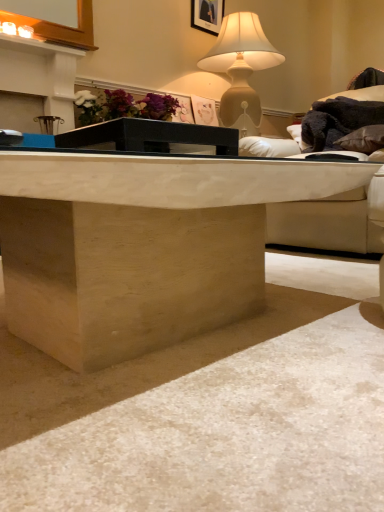
Question: Does black glass table at center have a larger size compared to brown leather pillow at upper right?

Choices:
 (A) no
 (B) yes

Answer: (A)

Question: Can you confirm if black glass table at center is taller than brown leather pillow at upper right?

Choices:
 (A) no
 (B) yes

Answer: (A)

Question: Does black glass table at center have a lesser height compared to brown leather pillow at upper right?

Choices:
 (A) yes
 (B) no

Answer: (A)

Question: From the image's perspective, does black glass table at center appear lower than brown leather pillow at upper right?

Choices:
 (A) no
 (B) yes

Answer: (B)

Question: Considering the relative positions of black glass table at center and brown leather pillow at upper right in the image provided, is black glass table at center in front of brown leather pillow at upper right?

Choices:
 (A) yes
 (B) no

Answer: (A)

Question: Is brown leather pillow at upper right bigger or smaller than white leather couch at upper right?

Choices:
 (A) small
 (B) big

Answer: (A)

Question: From their relative heights in the image, would you say brown leather pillow at upper right is taller or shorter than white leather couch at upper right?

Choices:
 (A) short
 (B) tall

Answer: (A)

Question: From a real-world perspective, relative to white leather couch at upper right, is brown leather pillow at upper right vertically above or below?

Choices:
 (A) below
 (B) above

Answer: (B)

Question: Considering the positions of brown leather pillow at upper right and white leather couch at upper right in the image, is brown leather pillow at upper right wider or thinner than white leather couch at upper right?

Choices:
 (A) wide
 (B) thin

Answer: (B)

Question: Considering the positions of point (263, 48) and point (210, 142), is point (263, 48) closer or farther from the camera than point (210, 142)?

Choices:
 (A) closer
 (B) farther

Answer: (B)

Question: Is matte beige lamp at upper center wider or thinner than black glass table at center?

Choices:
 (A) wide
 (B) thin

Answer: (A)

Question: In the image, is matte beige lamp at upper center on the left side or the right side of black glass table at center?

Choices:
 (A) left
 (B) right

Answer: (B)

Question: In terms of height, does matte beige lamp at upper center look taller or shorter compared to black glass table at center?

Choices:
 (A) tall
 (B) short

Answer: (A)

Question: Does point (215, 0) appear closer or farther from the camera than point (362, 252)?

Choices:
 (A) farther
 (B) closer

Answer: (A)

Question: In terms of height, does matte black picture frame at upper center look taller or shorter compared to white leather couch at upper right?

Choices:
 (A) tall
 (B) short

Answer: (B)